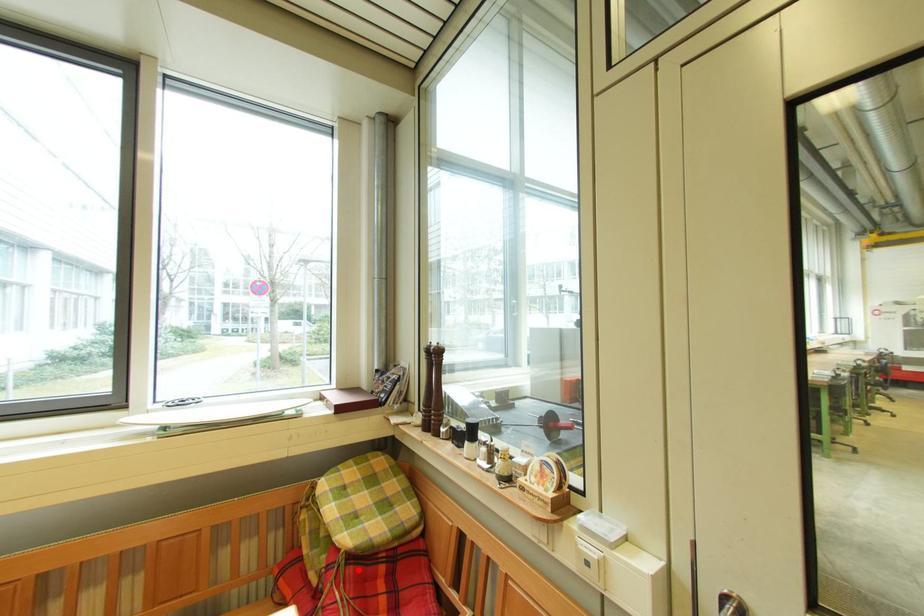
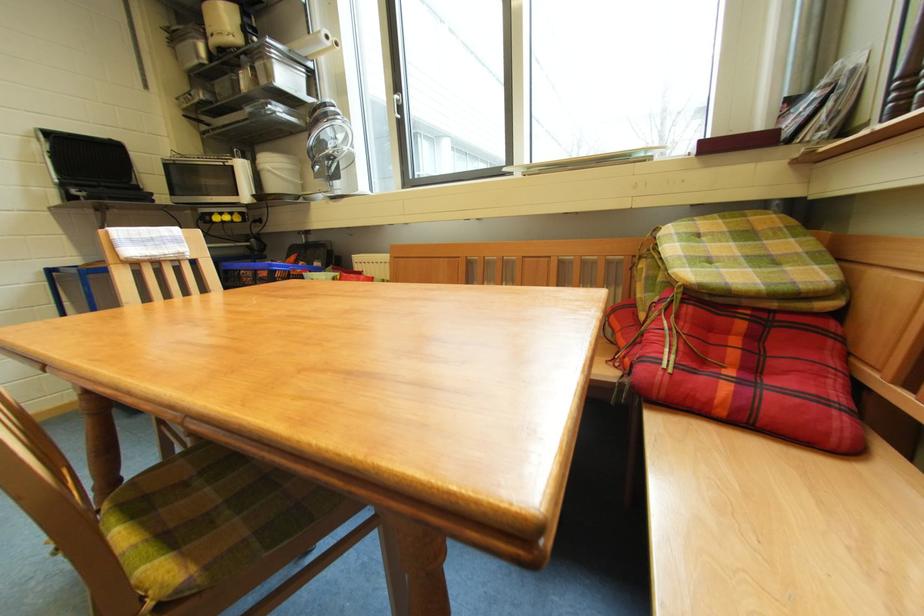
Question: I am providing you with two images of the same scene from different viewpoints. A red point is marked on the first image. Can you still see the location of the red point in image 2?

Choices:
 (A) Yes
 (B) No

Answer: (A)